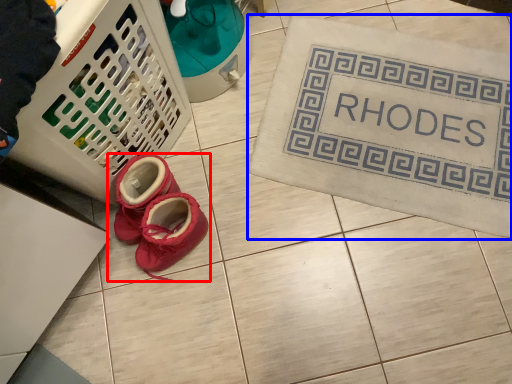
Question: Which of the following is the closest to the observer, footwear (highlighted by a red box) or bath mat (highlighted by a blue box)?

Choices:
 (A) footwear
 (B) bath mat

Answer: (A)